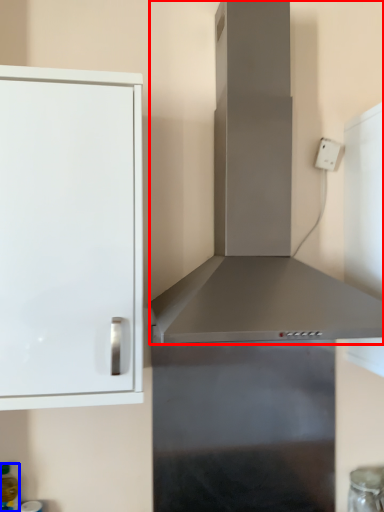
Question: Which of the following is the farthest to the observer, vent (highlighted by a red box) or bottle (highlighted by a blue box)?

Choices:
 (A) vent
 (B) bottle

Answer: (B)